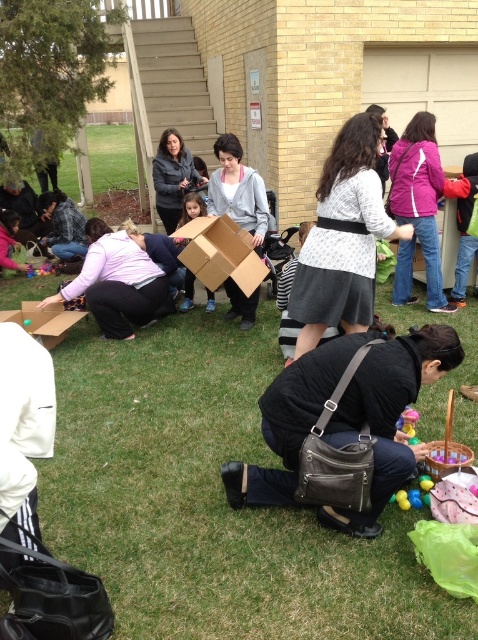
Which is below, cardboard box at center or matte cardboard box at center?

cardboard box at center is lower down.

Between cardboard box at center and matte cardboard box at center, which one has less height?

With less height is matte cardboard box at center.

Between point (229, 256) and point (183, 307), which one is positioned in front?

Point (229, 256) is in front.

This screenshot has height=640, width=478. I want to click on cardboard box at center, so click(220, 253).

Is cardboard box at center in front of cardboard box at lower left?

That is False.

Who is positioned more to the right, cardboard box at center or cardboard box at lower left?

cardboard box at center is more to the right.

Between point (206, 236) and point (61, 305), which one is positioned behind?

Point (61, 305)

Identify the location of cardboard box at center. This screenshot has width=478, height=640. (220, 253).

Does cardboard box at lower left have a larger size compared to matte cardboard box at center?

Indeed, cardboard box at lower left has a larger size compared to matte cardboard box at center.

Does cardboard box at lower left appear on the right side of matte cardboard box at center?

In fact, cardboard box at lower left is to the left of matte cardboard box at center.

What are the coordinates of `cardboard box at lower left` in the screenshot? It's located at (43, 321).